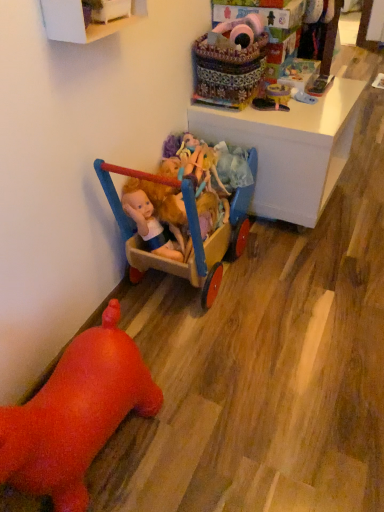
Find the location of `vacant space in front of wooden cart at center, which is counted as the 5th toy, starting from the top`. vacant space in front of wooden cart at center, which is counted as the 5th toy, starting from the top is located at coordinates (243, 369).